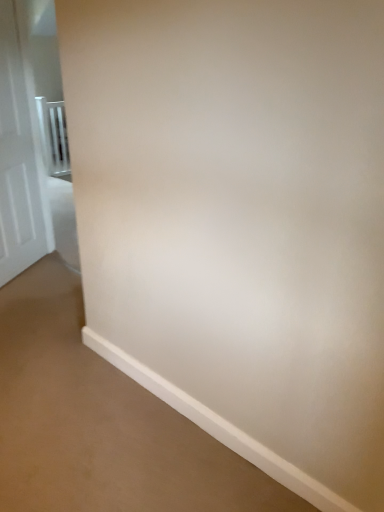
The image size is (384, 512). I want to click on vacant space in front of white glossy door at left, so coord(31,291).